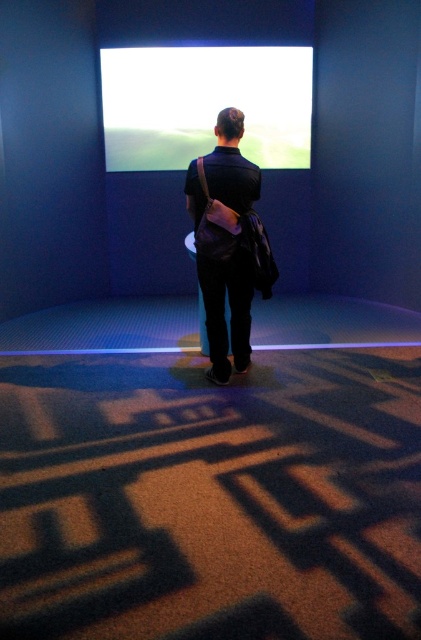
In order to click on white glossy screen at upper center in this screenshot , I will do `click(205, 104)`.

Does point (300, 147) come behind point (207, 195)?

Yes, it is behind point (207, 195).

This screenshot has height=640, width=421. Identify the location of white glossy screen at upper center. (205, 104).